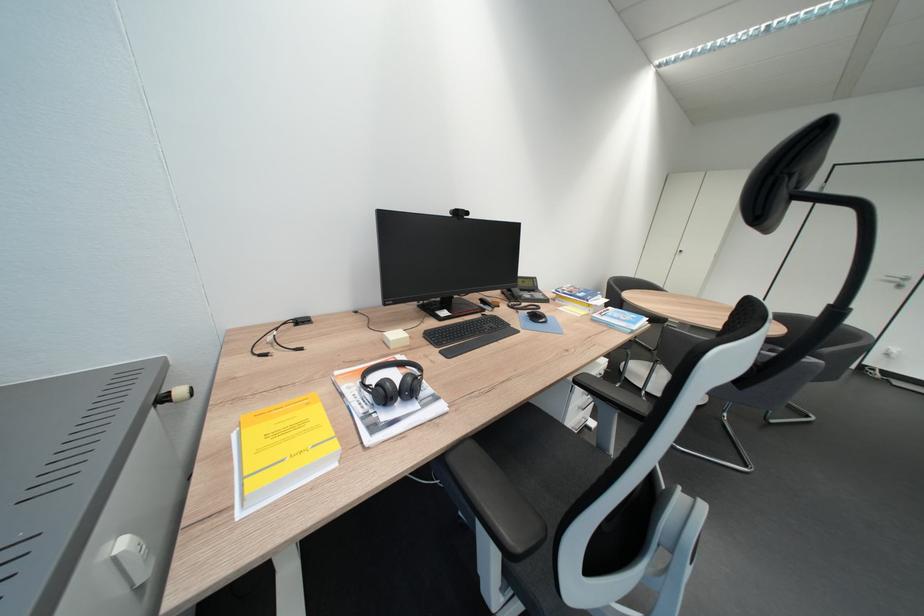
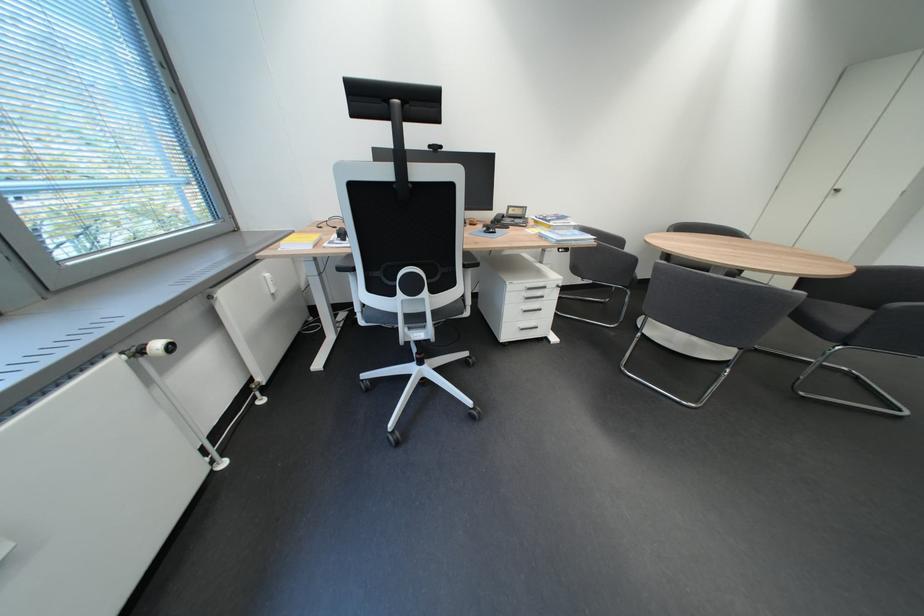
Question: What movement of the cameraman would produce the second image?

Choices:
 (A) Left
 (B) Right
 (C) Forward
 (D) Backward

Answer: (B)